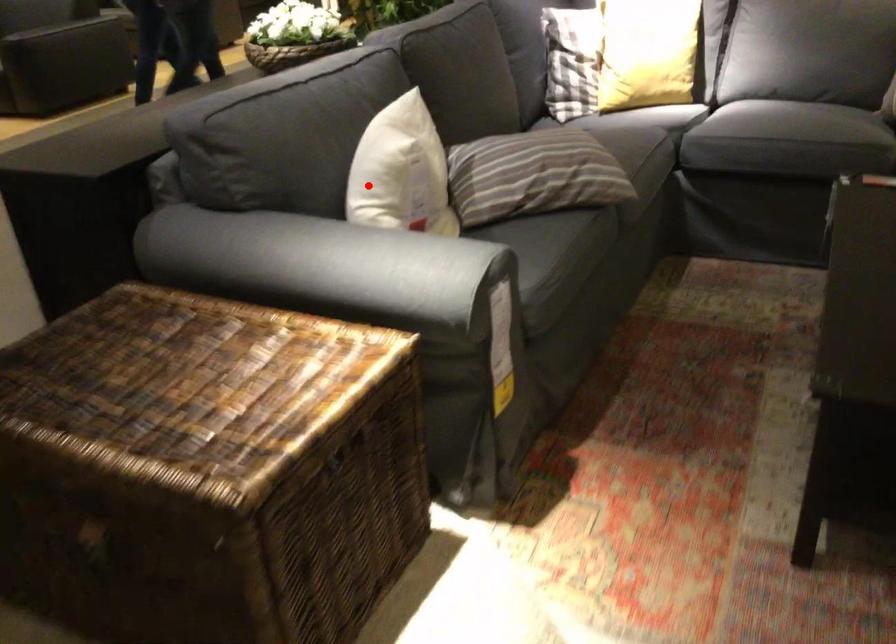
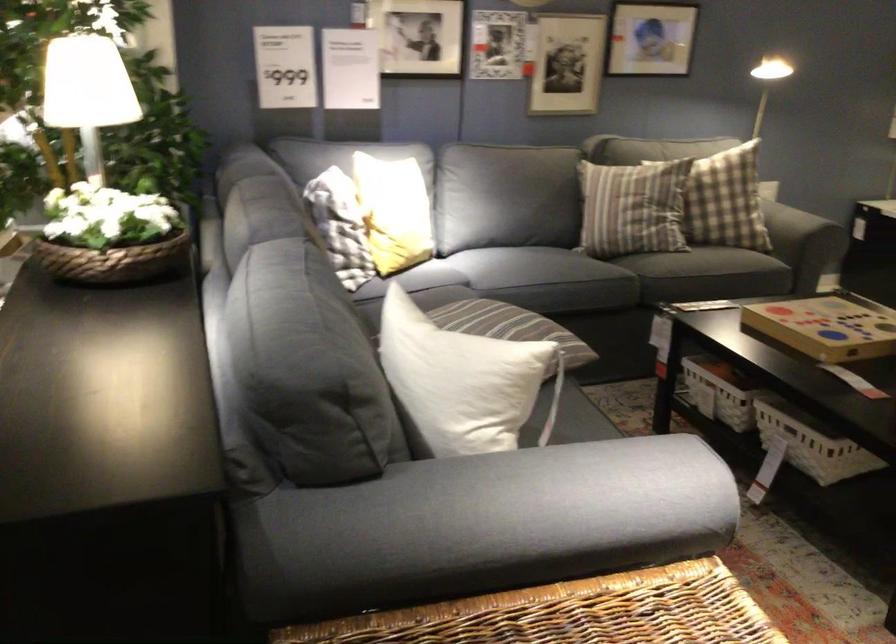
In the second image, find the point that corresponds to the highlighted location in the first image.

(462, 381)